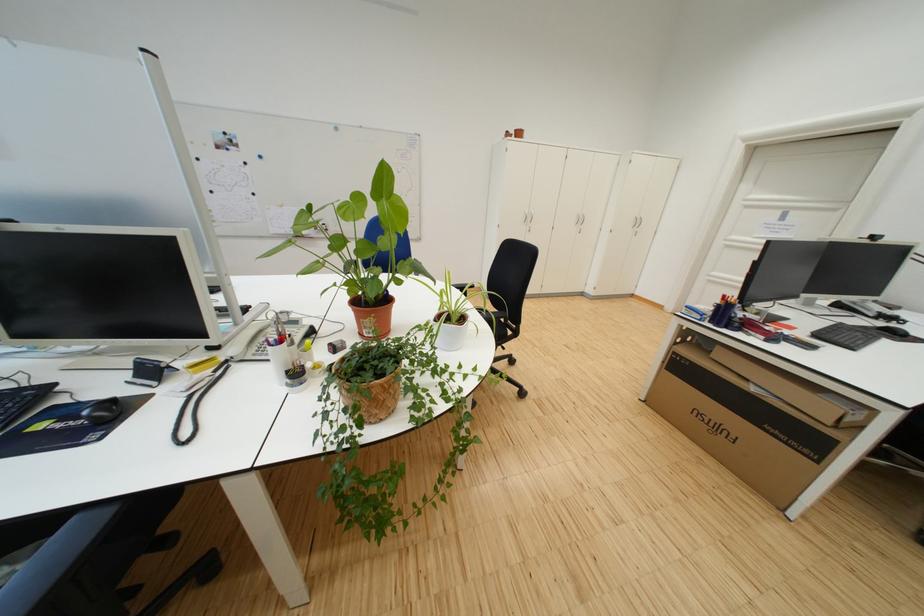
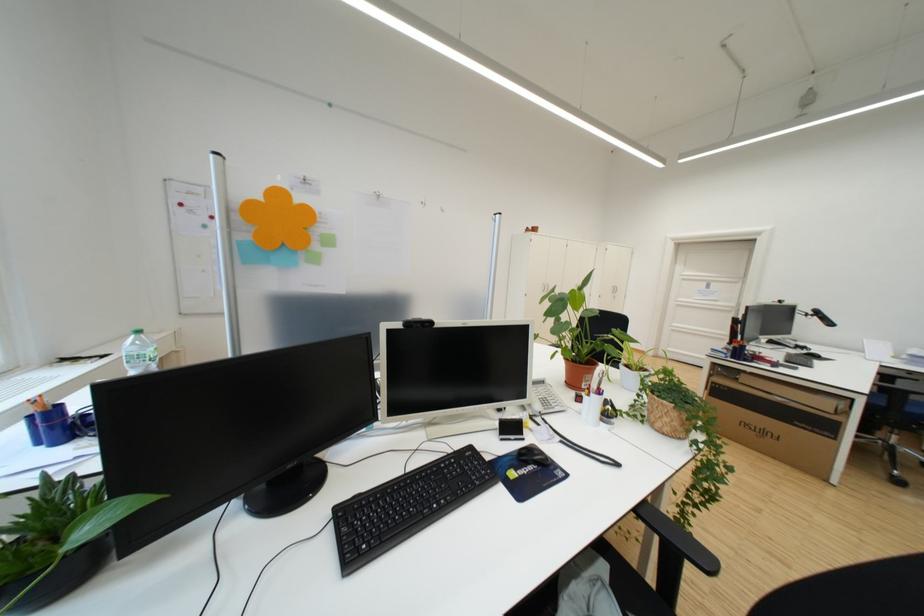
Question: Which direction would the cameraman need to move to produce the second image? Reply with the corresponding letter.

Choices:
 (A) Left
 (B) Right
 (C) Forward
 (D) Backward

Answer: (A)